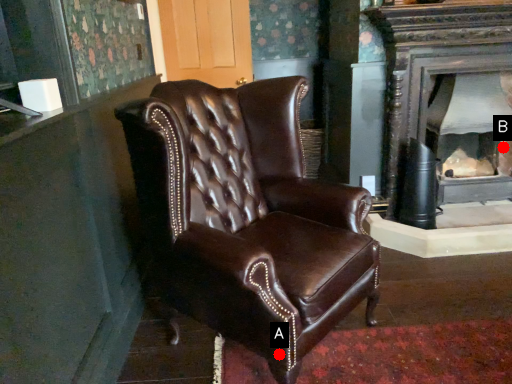
Question: Two points are circled on the image, labeled by A and B beside each circle. Which point is further to the camera?

Choices:
 (A) A is further
 (B) B is further

Answer: (B)